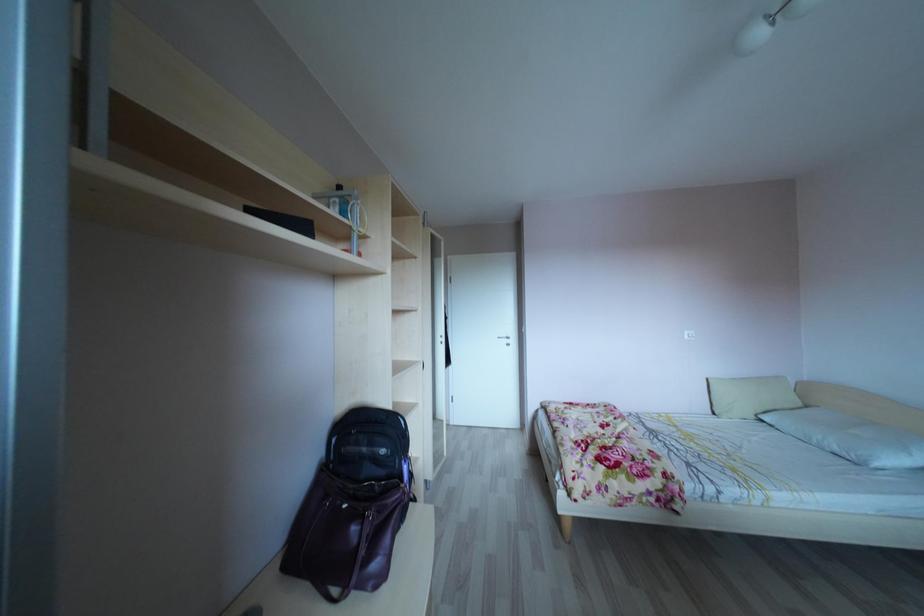
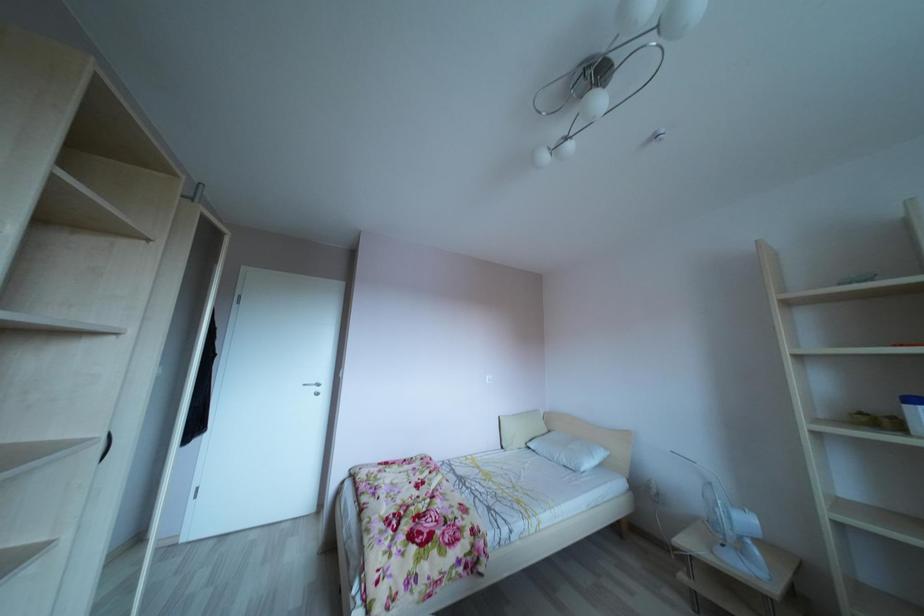
Question: How did the camera likely rotate?

Choices:
 (A) Left
 (B) Right
 (C) Up
 (D) Down

Answer: (B)